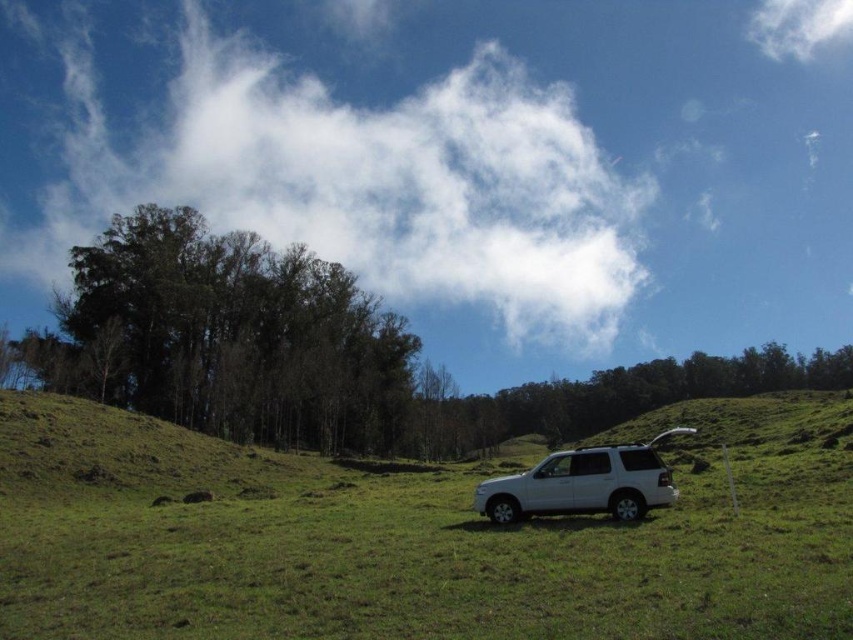
Question: Which point is farther from the camera taking this photo?

Choices:
 (A) (213, 84)
 (B) (294, 561)
 (C) (556, 460)

Answer: (A)

Question: Which of the following is the farthest from the observer?

Choices:
 (A) white fluffy cloud at upper center
 (B) white matte suv at center
 (C) green grassy field at center

Answer: (A)

Question: Is green grassy field at center to the right of white matte suv at center from the viewer's perspective?

Choices:
 (A) yes
 (B) no

Answer: (B)

Question: Can you confirm if green grassy field at center is positioned to the left of white fluffy cloud at upper center?

Choices:
 (A) yes
 (B) no

Answer: (B)

Question: Which of the following is the closest to the observer?

Choices:
 (A) (614, 506)
 (B) (196, 545)

Answer: (B)

Question: Does green grassy field at center lie behind white fluffy cloud at upper center?

Choices:
 (A) no
 (B) yes

Answer: (A)